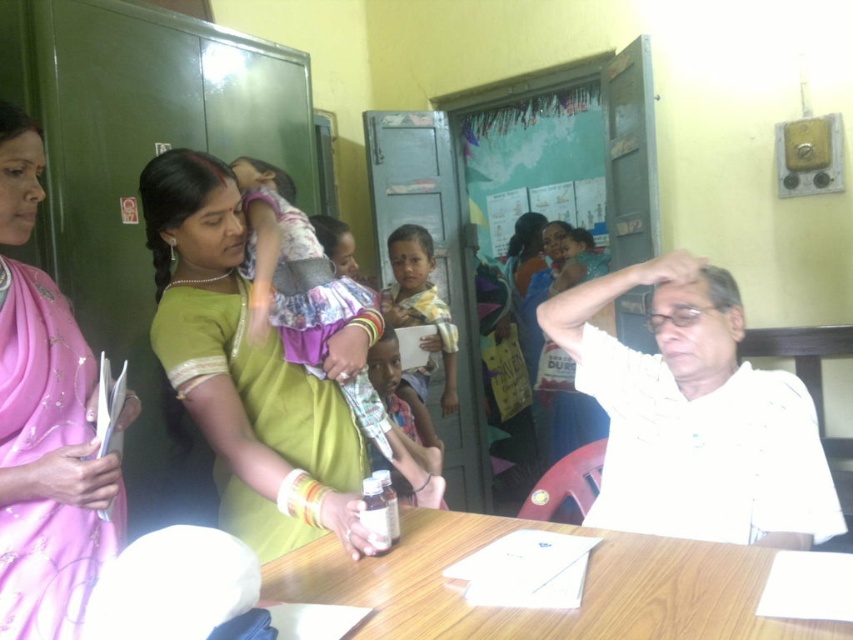
How far apart are green silk saree at center and wooden table at center?

green silk saree at center is 14.16 inches away from wooden table at center.

Is green silk saree at center to the left of wooden table at center from the viewer's perspective?

Indeed, green silk saree at center is positioned on the left side of wooden table at center.

Does point (358, 534) lie behind point (744, 573)?

Yes.

Locate an element on the screen. The width and height of the screenshot is (853, 640). green silk saree at center is located at coordinates (248, 369).

Is light purple fabric dress at center positioned at the back of matte plastic bottle at center?

That is False.

Is light purple fabric dress at center positioned in front of matte plastic bottle at center?

Yes, light purple fabric dress at center is in front of matte plastic bottle at center.

At what (x,y) coordinates should I click in order to perform the action: click on light purple fabric dress at center. Please return your answer as a coordinate pair (x, y). The height and width of the screenshot is (640, 853). Looking at the image, I should click on tap(291, 268).

Find the location of a particular element. light purple fabric dress at center is located at coordinates (291, 268).

Can you confirm if pink satin saree at left is positioned to the left of wooden table at center?

Yes, pink satin saree at left is to the left of wooden table at center.

Between pink satin saree at left and wooden table at center, which one is positioned higher?

pink satin saree at left is above.

Between point (50, 476) and point (746, 566), which one is positioned behind?

The point (746, 566) is behind.

Locate an element on the screen. The height and width of the screenshot is (640, 853). pink satin saree at left is located at coordinates (48, 461).